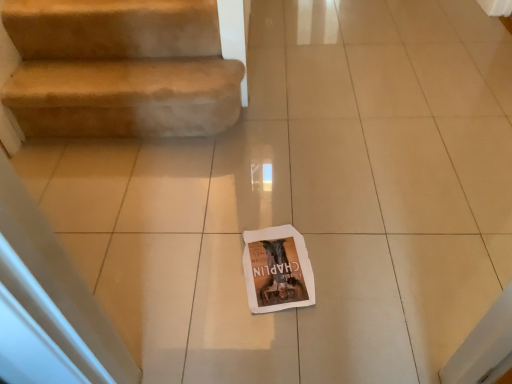
Where is `free space above white paper at center (from a real-world perspective)`? This screenshot has height=384, width=512. free space above white paper at center (from a real-world perspective) is located at coordinates (281, 277).